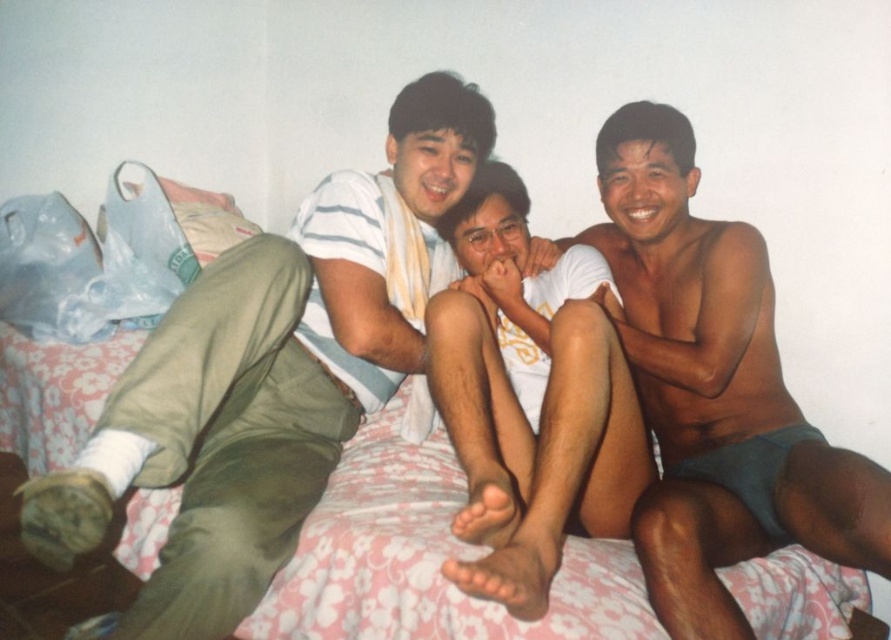
You are a photographer trying to capture a candid shot of the smooth skin torso at center and the white cotton shirt at center. Since you want to focus on the torso, which object should you adjust your camera to prioritize in terms of depth of field?

The smooth skin torso at center is closer to the viewer than the white cotton shirt at center, so adjusting the depth of field to focus on the torso will keep it sharp while blurring the background, including the white cotton shirt at center.

You are a photographer trying to capture a candid shot of the matte khaki pants at center and the smooth skin torso at center in the image. The camera you are using has a depth of field that can clearly focus on objects within 20 inches of each other. Will both subjects be in focus in the photo?

The matte khaki pants at center and smooth skin torso at center are 22.21 inches apart from each other. Since the distance between them exceeds the camera s 20 inch depth of field range, both subjects will not be in focus simultaneously in the photo.